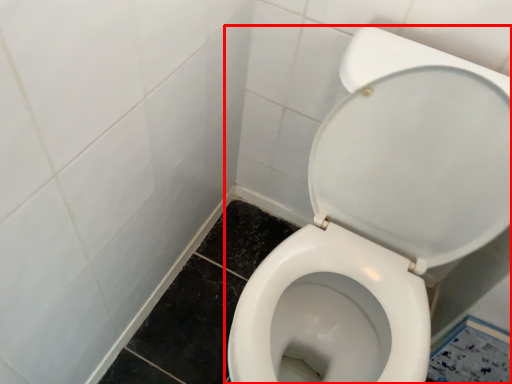
Question: From the image's perspective, what is the correct spatial positioning of toilet (annotated by the red box) in reference to square?

Choices:
 (A) above
 (B) below

Answer: (A)